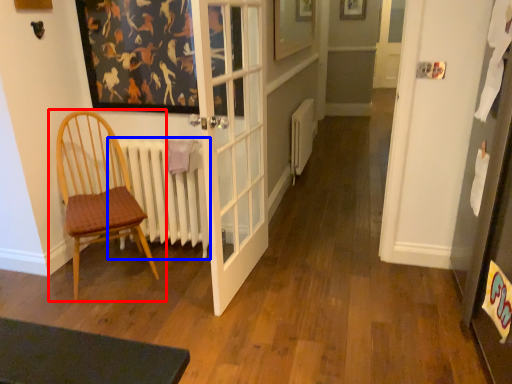
Question: Which object appears farthest to the camera in this image, chair (highlighted by a red box) or radiator (highlighted by a blue box)?

Choices:
 (A) chair
 (B) radiator

Answer: (B)